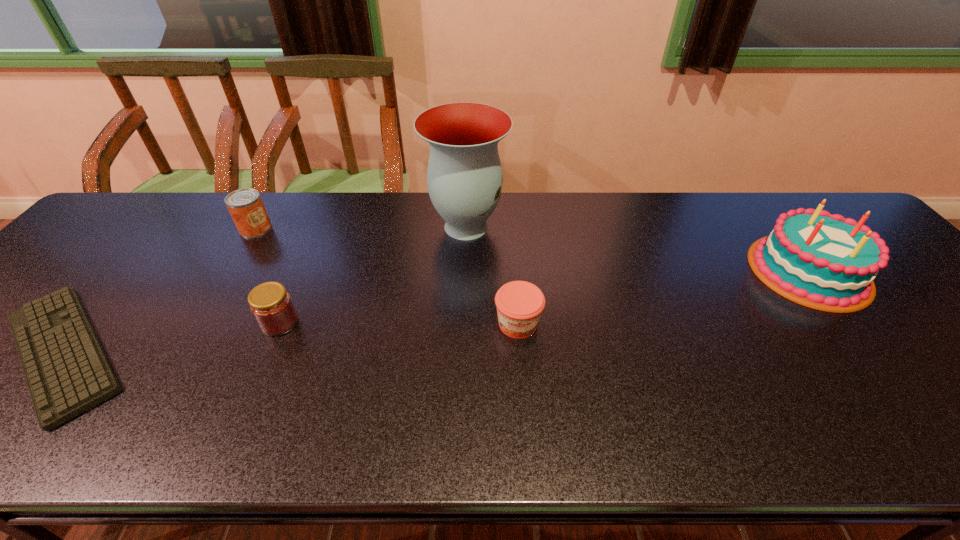
This screenshot has width=960, height=540. In order to click on vacant space in between the can and the vase in this screenshot , I will do `click(361, 227)`.

Identify the location of empty space between the tallest object and the fourth object from right to left. Image resolution: width=960 pixels, height=540 pixels. (372, 274).

Where is `vacant space in between the left jam and the rightmost object`? This screenshot has height=540, width=960. vacant space in between the left jam and the rightmost object is located at coordinates (544, 296).

Find the location of a particular element. The width and height of the screenshot is (960, 540). empty space between the second tallest object and the right jam is located at coordinates (663, 298).

This screenshot has height=540, width=960. In order to click on free space between the left jam and the right jam in this screenshot , I will do `click(398, 323)`.

In order to click on object that is the third closest to the shortest object in this screenshot , I will do `click(464, 176)`.

Identify which object is located as the fifth nearest to the leftmost object. Please provide its 2D coordinates. Your answer should be formatted as a tuple, i.e. [(x, y)], where the tuple contains the x and y coordinates of a point satisfying the conditions above.

[(823, 261)]

Identify the location of free spot that satisfies the following two spatial constraints: 1. on the front side of the second tallest object; 2. on the right side of the can. (230, 271).

Where is `free region that satisfies the following two spatial constraints: 1. on the back side of the can; 2. on the right side of the tallest object`? This screenshot has width=960, height=540. free region that satisfies the following two spatial constraints: 1. on the back side of the can; 2. on the right side of the tallest object is located at coordinates (256, 227).